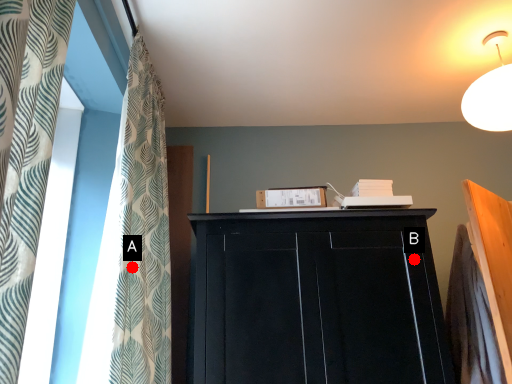
Question: Two points are circled on the image, labeled by A and B beside each circle. Which point is further to the camera?

Choices:
 (A) A is further
 (B) B is further

Answer: (B)